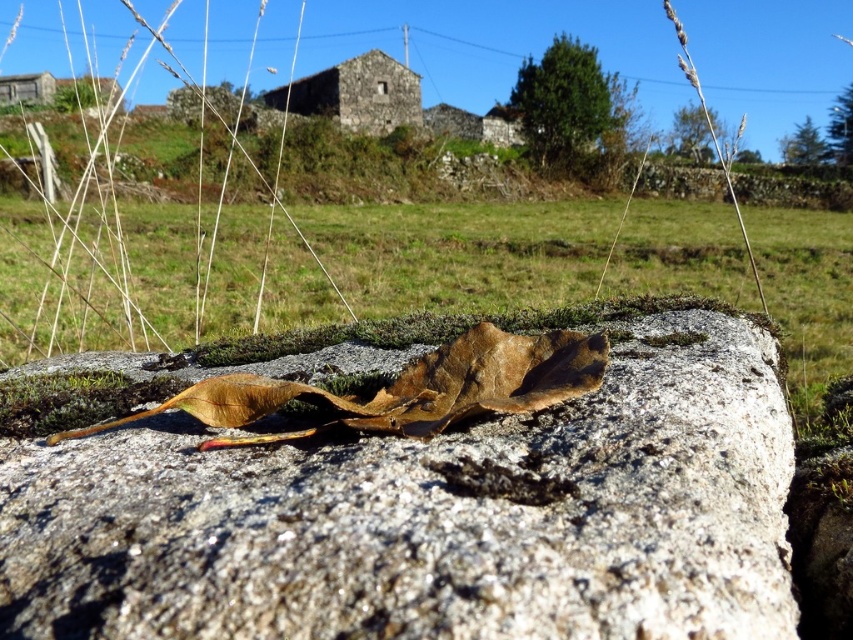
You are a hiker standing at the point marked as point (430, 516) in the image. Looking around, you see a granite rock at center. Which direction should you move to reach the granite rock at center?

You are already at the granite rock at center since the point (430, 516) is where it is located.

You are standing in the rural landscape and want to place a small flag exactly at the center of the image. According to the scene, where should you place the flag relative to the granite rock at center and the green grass at center?

The granite rock at center is to the right of green grass at center, so you should place the flag to the left of the granite rock at center and to the right of the green grass at center to mark the center of the image.